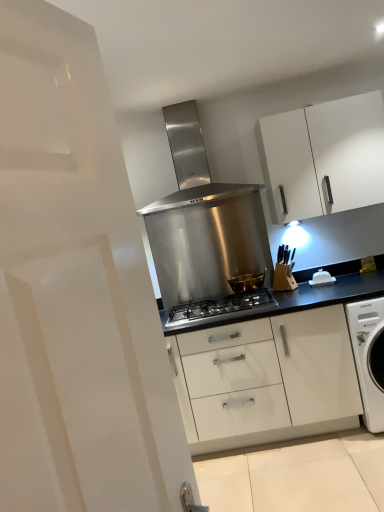
The width and height of the screenshot is (384, 512). Describe the element at coordinates (323, 157) in the screenshot. I see `white matte cabinet at upper right` at that location.

This screenshot has height=512, width=384. What do you see at coordinates (247, 282) in the screenshot?
I see `gold metallic bowl at center` at bounding box center [247, 282].

Identify the location of stainless steel gas stove at center. (220, 309).

The width and height of the screenshot is (384, 512). Describe the element at coordinates (322, 278) in the screenshot. I see `white plastic butter dish at center-right` at that location.

Describe the element at coordinates (203, 221) in the screenshot. I see `stainless steel range hood at center` at that location.

Identify the location of white matte cabinet at upper right. The height and width of the screenshot is (512, 384). (323, 157).

Is white plastic butter dish at center-right far from stainless steel gas stove at center?

They are positioned close to each other.

Between white plastic butter dish at center-right and stainless steel gas stove at center, which one has smaller width?

Thinner between the two is white plastic butter dish at center-right.

The height and width of the screenshot is (512, 384). I want to click on gas stove on the left of the white plastic butter dish at center-right, so (x=220, y=309).

Is stainless steel gas stove at center at the back of white plastic butter dish at center-right?

white plastic butter dish at center-right does not have its back to stainless steel gas stove at center.

From the image's perspective, is stainless steel range hood at center located beneath white plastic butter dish at center-right?

No, from the image's perspective, stainless steel range hood at center is not below white plastic butter dish at center-right.

Considering the relative sizes of stainless steel range hood at center and white plastic butter dish at center-right in the image provided, is stainless steel range hood at center thinner than white plastic butter dish at center-right?

No.

Where is `appliance in front of the stainless steel range hood at center`? The image size is (384, 512). appliance in front of the stainless steel range hood at center is located at coordinates (322, 278).

Does point (157, 230) come farther from viewer compared to point (325, 277)?

Yes, point (157, 230) is behind point (325, 277).

Could you tell me if white matte cabinet at upper right is facing gold metallic bowl at center?

No, white matte cabinet at upper right is not aimed at gold metallic bowl at center.

Based on the photo, considering the positions of objects white matte cabinet at upper right and gold metallic bowl at center in the image provided, who is in front, white matte cabinet at upper right or gold metallic bowl at center?

Positioned in front is white matte cabinet at upper right.

From a real-world perspective, is white matte cabinet at upper right physically located above or below gold metallic bowl at center?

In terms of real-world spatial position, white matte cabinet at upper right is above gold metallic bowl at center.

From the image's perspective, is white matte cabinet at upper right below gold metallic bowl at center?

No, from the image's perspective, white matte cabinet at upper right is not beneath gold metallic bowl at center.

Do you think white matte cabinet at upper right is within white plastic butter dish at center-right, or outside of it?

white matte cabinet at upper right is spatially situated outside white plastic butter dish at center-right.

From the image's perspective, which object appears higher, white matte cabinet at upper right or white plastic butter dish at center-right?

white matte cabinet at upper right, from the image's perspective.

Is point (317, 186) closer to camera compared to point (312, 286)?

Yes.

Find the location of `appliance that is under the white matte cabinet at upper right (from a real-world perspective)`. appliance that is under the white matte cabinet at upper right (from a real-world perspective) is located at coordinates (322, 278).

Considering the sizes of white plastic butter dish at center-right and stainless steel range hood at center in the image, is white plastic butter dish at center-right wider or thinner than stainless steel range hood at center?

Clearly, white plastic butter dish at center-right has less width compared to stainless steel range hood at center.

Considering the positions of objects white plastic butter dish at center-right and stainless steel range hood at center in the image provided, who is more to the left, white plastic butter dish at center-right or stainless steel range hood at center?

stainless steel range hood at center.

Can stainless steel range hood at center be found inside white plastic butter dish at center-right?

No, stainless steel range hood at center is not surrounded by white plastic butter dish at center-right.

From a real-world perspective, who is located lower, gold metallic bowl at center or white matte cabinet at upper right?

gold metallic bowl at center.

Is gold metallic bowl at center taller or shorter than white matte cabinet at upper right?

Clearly, gold metallic bowl at center is shorter compared to white matte cabinet at upper right.

Which object is wider, gold metallic bowl at center or white matte cabinet at upper right?

white matte cabinet at upper right.

Considering the positions of objects gold metallic bowl at center and white matte cabinet at upper right in the image provided, who is behind, gold metallic bowl at center or white matte cabinet at upper right?

gold metallic bowl at center is further from the camera.

Is white matte cabinet at upper right outside of stainless steel range hood at center?

Yes.

From the image's perspective, is white matte cabinet at upper right above or below stainless steel range hood at center?

white matte cabinet at upper right is above stainless steel range hood at center.

Based on the photo, how distant is white matte cabinet at upper right from stainless steel range hood at center?

white matte cabinet at upper right is 59.05 centimeters away from stainless steel range hood at center.

Are white matte cabinet at upper right and stainless steel range hood at center located far from each other?

No, white matte cabinet at upper right is not far away from stainless steel range hood at center.

Find the location of `appliance lying above the stainless steel gas stove at center (from the image's perspective)`. appliance lying above the stainless steel gas stove at center (from the image's perspective) is located at coordinates (322, 278).

Where is `home appliance located behind the white plastic butter dish at center-right`? Image resolution: width=384 pixels, height=512 pixels. home appliance located behind the white plastic butter dish at center-right is located at coordinates (203, 221).

Estimate the real-world distances between objects in this image. Which object is further from white plastic butter dish at center-right, stainless steel gas stove at center or white matte cabinet at upper right?

white matte cabinet at upper right lies further to white plastic butter dish at center-right than the other object.

Considering their positions, is stainless steel range hood at center positioned closer to gold metallic bowl at center than stainless steel gas stove at center?

Among the two, stainless steel gas stove at center is located nearer to gold metallic bowl at center.

Estimate the real-world distances between objects in this image. Which object is closer to white matte cabinet at upper right, stainless steel range hood at center or gold metallic bowl at center?

stainless steel range hood at center is closer to white matte cabinet at upper right.

Based on their spatial positions, is gold metallic bowl at center or white matte cabinet at upper right closer to white plastic butter dish at center-right?

Based on the image, gold metallic bowl at center appears to be nearer to white plastic butter dish at center-right.

Estimate the real-world distances between objects in this image. Which object is further from stainless steel gas stove at center, white plastic butter dish at center-right or gold metallic bowl at center?

The object further to stainless steel gas stove at center is white plastic butter dish at center-right.

When comparing their distances from white plastic butter dish at center-right, does white matte cabinet at upper right or stainless steel range hood at center seem further?

Among the two, stainless steel range hood at center is located further to white plastic butter dish at center-right.

When comparing their distances from white matte cabinet at upper right, does stainless steel range hood at center or stainless steel gas stove at center seem further?

Based on the image, stainless steel gas stove at center appears to be further to white matte cabinet at upper right.

Consider the image. From the image, which object appears to be farther from white matte cabinet at upper right, white plastic butter dish at center-right or gold metallic bowl at center?

gold metallic bowl at center.

The width and height of the screenshot is (384, 512). Find the location of `appliance between white matte cabinet at upper right and gold metallic bowl at center in the up-down direction`. appliance between white matte cabinet at upper right and gold metallic bowl at center in the up-down direction is located at coordinates (322, 278).

This screenshot has height=512, width=384. In order to click on kitchen appliance between stainless steel gas stove at center and white plastic butter dish at center-right from left to right in this screenshot , I will do `click(247, 282)`.

In order to click on kitchen appliance that lies between white matte cabinet at upper right and stainless steel gas stove at center from top to bottom in this screenshot , I will do `click(247, 282)`.

The width and height of the screenshot is (384, 512). Find the location of `gas stove located between stainless steel range hood at center and white plastic butter dish at center-right in the left-right direction`. gas stove located between stainless steel range hood at center and white plastic butter dish at center-right in the left-right direction is located at coordinates (220, 309).